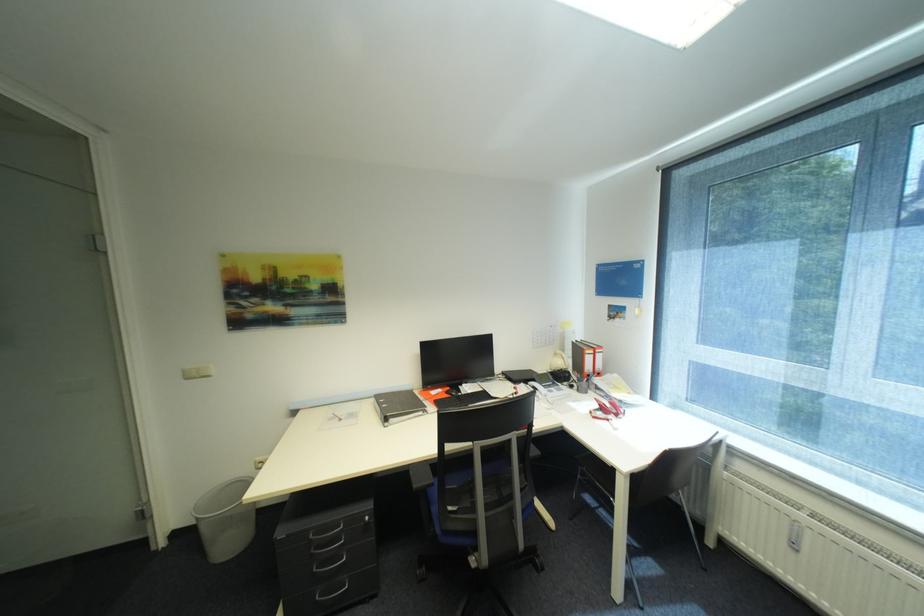
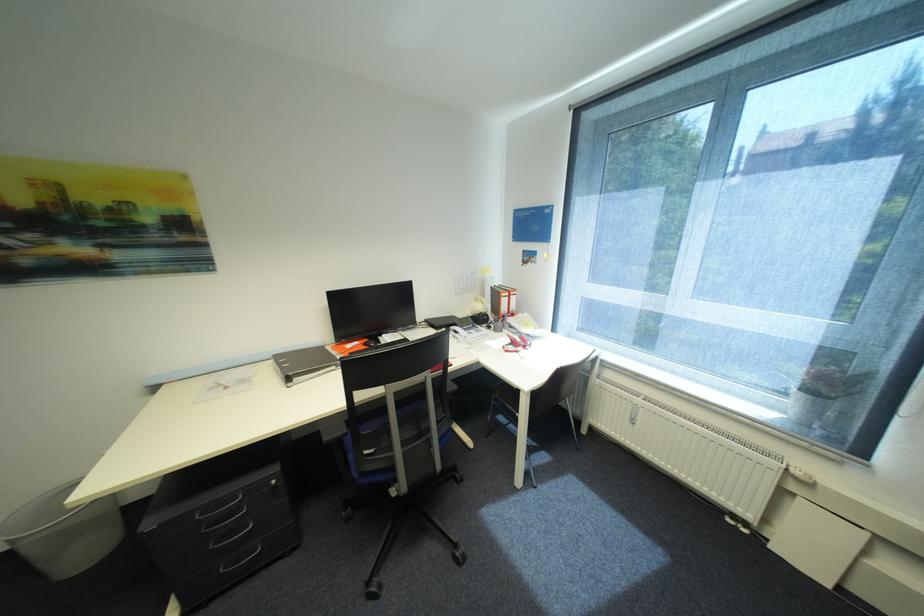
Find the pixel in the second image that matches point (579, 387) in the first image.

(496, 328)